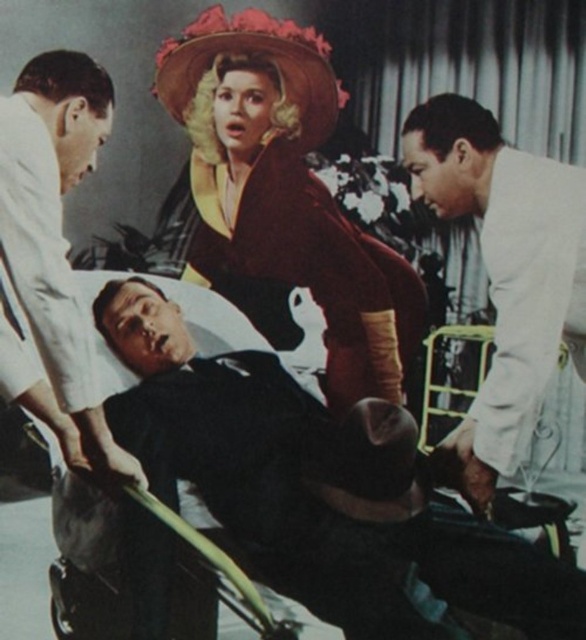
You are a photographer taking a picture of the scene. You need to ensure that the black matte suit at center and the white matte coat at right are both clearly visible in the frame. Based on their positions, which one should you focus on first to ensure both are in focus?

The black matte suit at center is in front of the white matte coat at right, so you should focus on the black matte suit at center first to ensure both are in focus.

You are a photographer trying to capture a closeup of the woman in the velvet maroon dress at center without including the white matte coat at right in the frame. Given their relative sizes, is this possible?

The velvet maroon dress at center is wider than the white matte coat at right, so it may be challenging to capture a closeup of the woman in the velvet maroon dress at center without including the white matte coat at right in the frame due to its larger width.

Looking at this image, you are a photographer trying to capture a closeup of the black matte suit at center and the white matte coat at right. Since you want to focus on both, which one should you zoom in on less to ensure both fit in the frame?

Since the black matte suit at center is wider than the white matte coat at right, you should zoom in less on the black matte suit at center to ensure both fit in the frame.